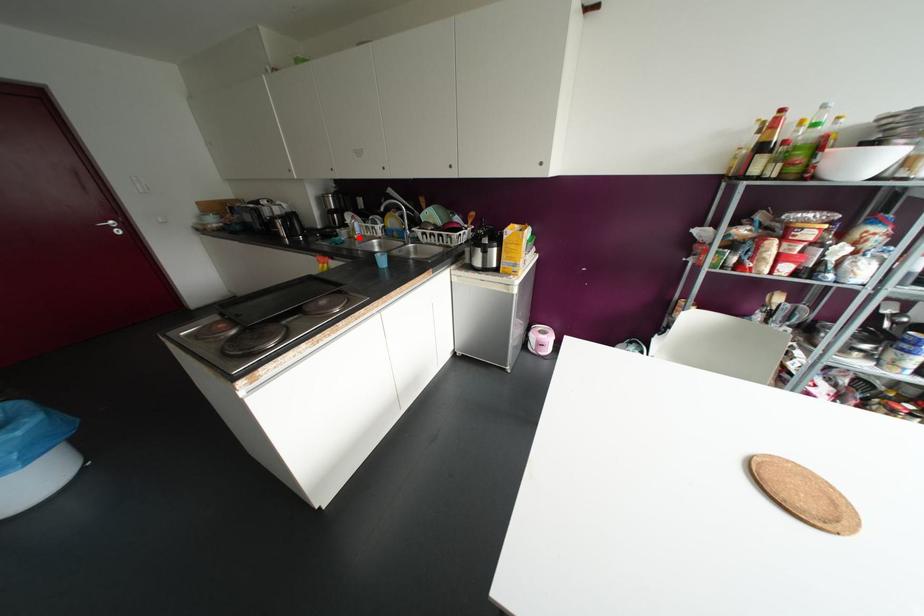
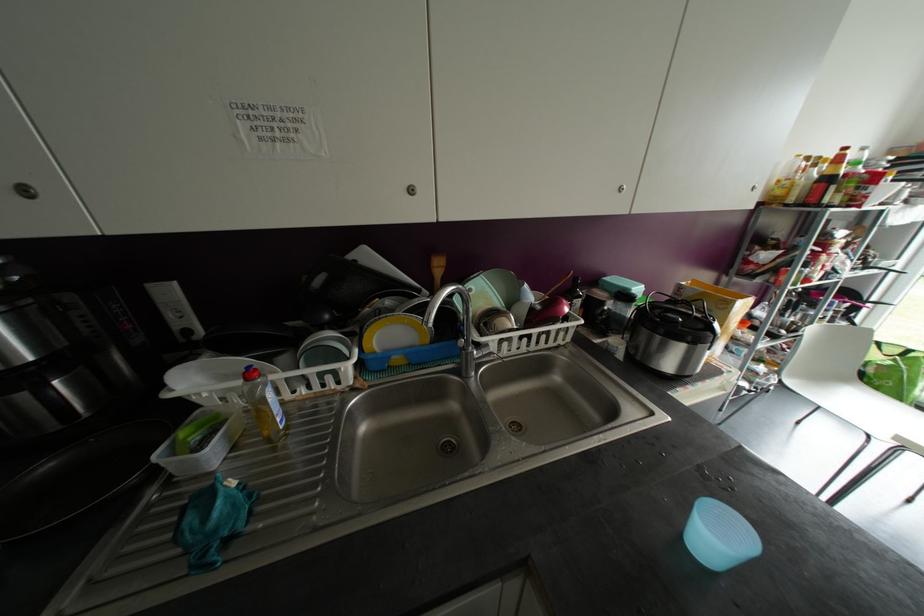
Question: I am providing you with two images of the same scene from different viewpoints. Image1 has a red point marked. In image2, the corresponding 3D location appears at what relative position? Reply with the corresponding letter.

Choices:
 (A) Closer
 (B) Farther

Answer: (A)